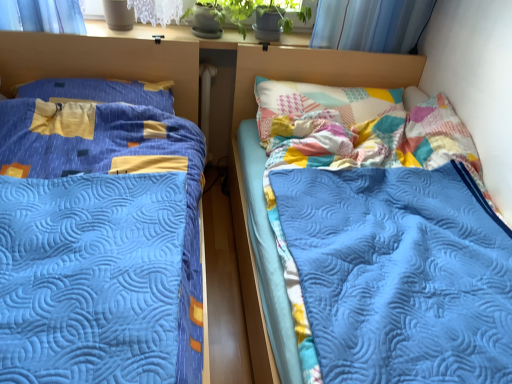
Question: Is blue quilted bed at right, which is the second bed from left to right, looking in the opposite direction of matte blue pillow at left?

Choices:
 (A) no
 (B) yes

Answer: (A)

Question: From a real-world perspective, is blue quilted bed at right, which is the second bed from left to right, positioned under matte blue pillow at left based on gravity?

Choices:
 (A) no
 (B) yes

Answer: (B)

Question: Considering the relative sizes of blue quilted bed at right, which is the first bed from right to left, and matte blue pillow at left in the image provided, is blue quilted bed at right, which is the first bed from right to left, bigger than matte blue pillow at left?

Choices:
 (A) yes
 (B) no

Answer: (A)

Question: Is blue quilted bed at right, which is the first bed from right to left, thinner than matte blue pillow at left?

Choices:
 (A) no
 (B) yes

Answer: (A)

Question: From the image's perspective, is blue quilted bed at right, which is the second bed from left to right, above matte blue pillow at left?

Choices:
 (A) no
 (B) yes

Answer: (A)

Question: From the image's perspective, is blue quilted bed at right, which is the first bed from right to left, under matte blue pillow at left?

Choices:
 (A) yes
 (B) no

Answer: (A)

Question: Is blue quilted bed at left, which is the 1th bed in left-to-right order, behind matte blue pillow at left?

Choices:
 (A) no
 (B) yes

Answer: (A)

Question: Is matte blue pillow at left located within blue quilted bed at left, which is the 1th bed in left-to-right order?

Choices:
 (A) yes
 (B) no

Answer: (A)

Question: Does blue quilted bed at left, which is the 1th bed in left-to-right order, have a greater height compared to matte blue pillow at left?

Choices:
 (A) yes
 (B) no

Answer: (A)

Question: Is blue quilted bed at left, which is the 1th bed in left-to-right order, not near matte blue pillow at left?

Choices:
 (A) no
 (B) yes

Answer: (A)

Question: Can you confirm if blue quilted bed at left, arranged as the 2th bed when viewed from the right, is positioned to the left of matte blue pillow at left?

Choices:
 (A) yes
 (B) no

Answer: (B)

Question: Is blue quilted bed at left, arranged as the 2th bed when viewed from the right, at the right side of matte blue pillow at left?

Choices:
 (A) no
 (B) yes

Answer: (B)

Question: Considering the relative sizes of patchwork fabric headboard at upper right and white matte radiator at center in the image provided, is patchwork fabric headboard at upper right taller than white matte radiator at center?

Choices:
 (A) no
 (B) yes

Answer: (A)